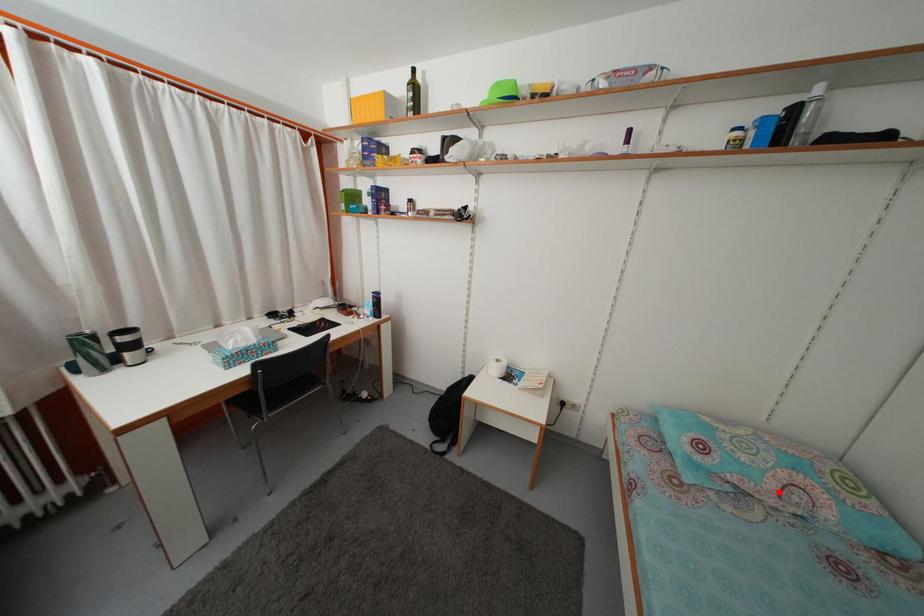
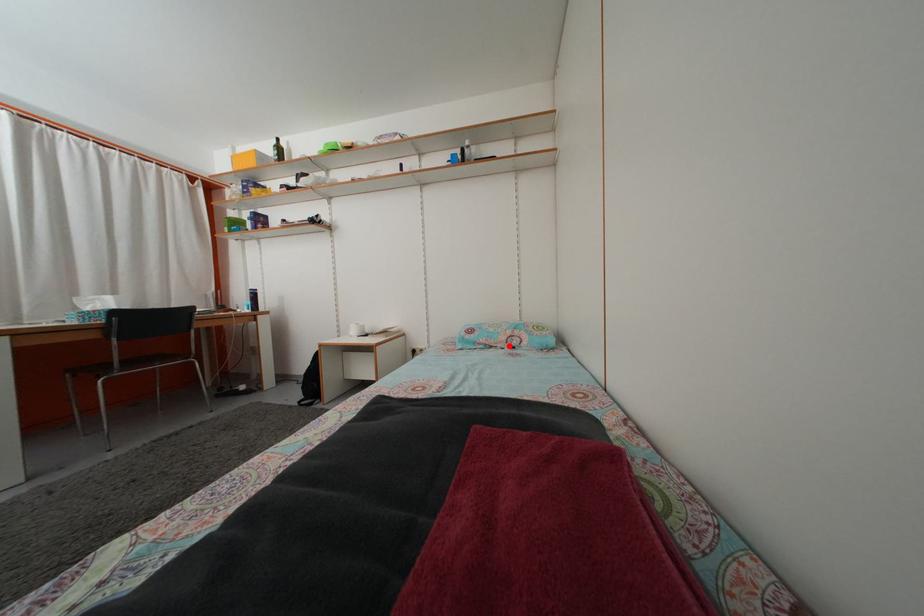
In the scene shown: I am providing you with two images of the same scene from different viewpoints. A red point is marked on the first image and another point is marked on the second image. Is the red point in image1 aligned with the point shown in image2?

Yes